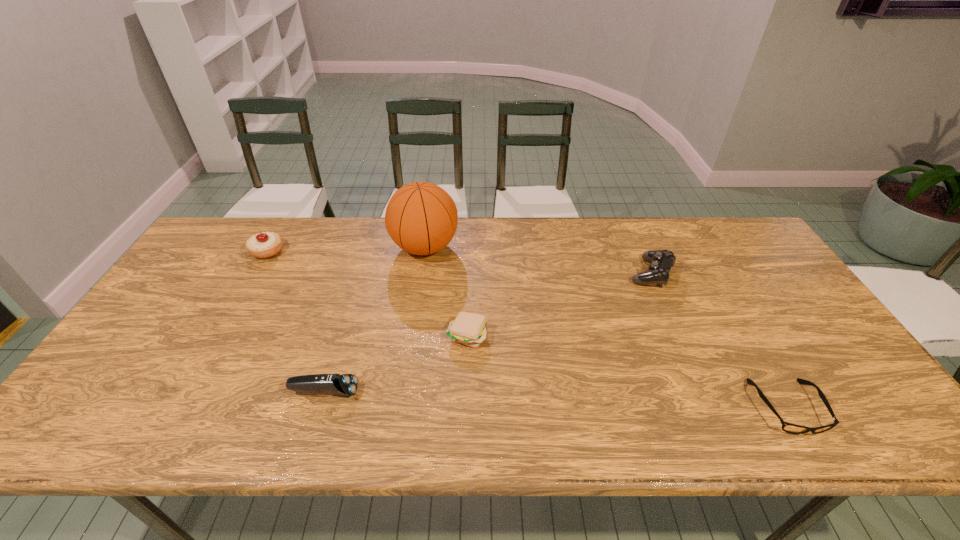
Locate an element on the screen. This screenshot has height=540, width=960. free space that is in between the patty and the control is located at coordinates (559, 304).

What are the coordinates of `free area in between the electric shaver and the pastry` in the screenshot? It's located at (296, 321).

Locate an element on the screen. empty space that is in between the pastry and the patty is located at coordinates 368,293.

Locate which object ranks fifth in proximity to the pastry. Please provide its 2D coordinates. Your answer should be formatted as a tuple, i.e. [(x, y)], where the tuple contains the x and y coordinates of a point satisfying the conditions above.

[(787, 427)]

Choose which object is the second nearest neighbor to the third nearest object. Please provide its 2D coordinates. Your answer should be formatted as a tuple, i.e. [(x, y)], where the tuple contains the x and y coordinates of a point satisfying the conditions above.

[(346, 384)]

Locate an element on the screen. This screenshot has width=960, height=540. vacant region that satisfies the following two spatial constraints: 1. on the front side of the second tallest object; 2. on the left side of the second object from right to left is located at coordinates (254, 273).